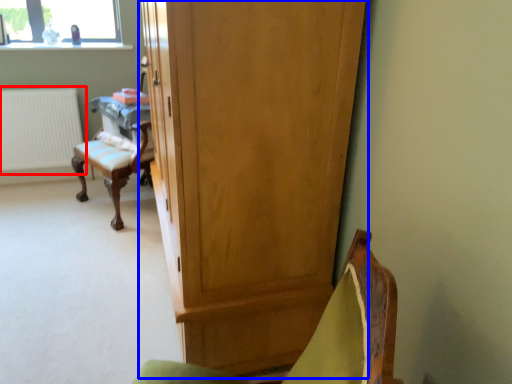
Question: Which object is closer to the camera taking this photo, radiator (highlighted by a red box) or cupboard (highlighted by a blue box)?

Choices:
 (A) radiator
 (B) cupboard

Answer: (B)